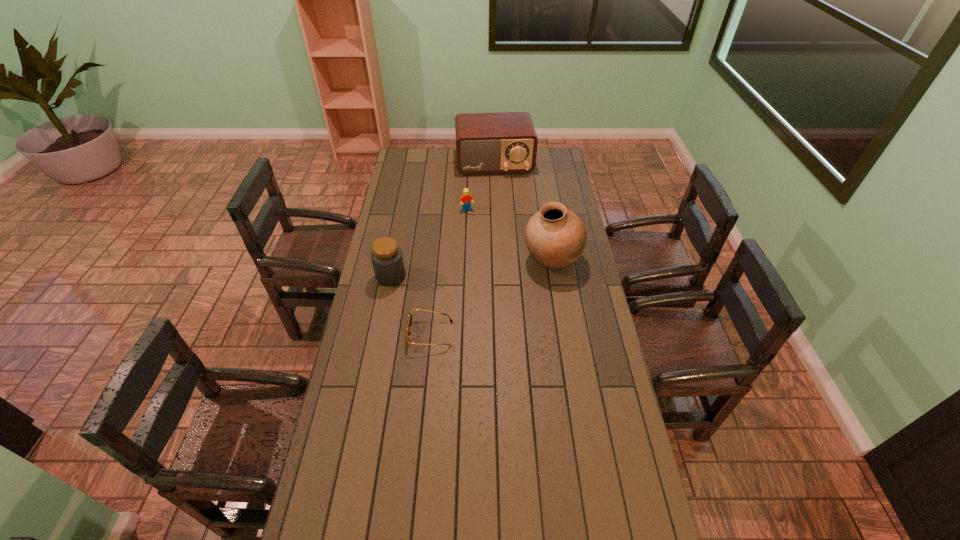
Where is `vacant space located on the lenses of the sunglasses`? vacant space located on the lenses of the sunglasses is located at coordinates (383, 334).

What are the coordinates of `free region located on the lenses of the sunglasses` in the screenshot? It's located at click(394, 334).

This screenshot has height=540, width=960. In order to click on vacant space located on the front of the pottery in this screenshot , I will do `click(558, 291)`.

You are a GUI agent. You are given a task and a screenshot of the screen. Output one action in this format:
    pyautogui.click(x=<x>, y=<y>)
    Task: Click on the free space located on the surface of the jar near the warning symbol
    The image size is (960, 540).
    Given the screenshot: What is the action you would take?
    pyautogui.click(x=449, y=291)

Find the location of `free point located 0.390m on the surface of the jar near the warning symbol`. free point located 0.390m on the surface of the jar near the warning symbol is located at coordinates pos(495,303).

Where is `vacant space located on the surface of the jar near the warning symbol`? The width and height of the screenshot is (960, 540). vacant space located on the surface of the jar near the warning symbol is located at coordinates (438, 288).

You are a GUI agent. You are given a task and a screenshot of the screen. Output one action in this format:
    pyautogui.click(x=<x>, y=<y>)
    Task: Click on the free location located on the face of the second farthest object
    Image resolution: width=960 pixels, height=540 pixels.
    Given the screenshot: What is the action you would take?
    pyautogui.click(x=489, y=257)

You are a GUI agent. You are given a task and a screenshot of the screen. Output one action in this format:
    pyautogui.click(x=<x>, y=<y>)
    Task: Click on the vacant space located on the face of the second farthest object
    The width and height of the screenshot is (960, 540).
    Given the screenshot: What is the action you would take?
    pyautogui.click(x=492, y=265)

Identify the location of vacant point located 0.400m on the face of the second farthest object. (494, 269).

Where is `vacant position located 0.370m on the front panel of the fourth shortest object`? The image size is (960, 540). vacant position located 0.370m on the front panel of the fourth shortest object is located at coordinates (504, 221).